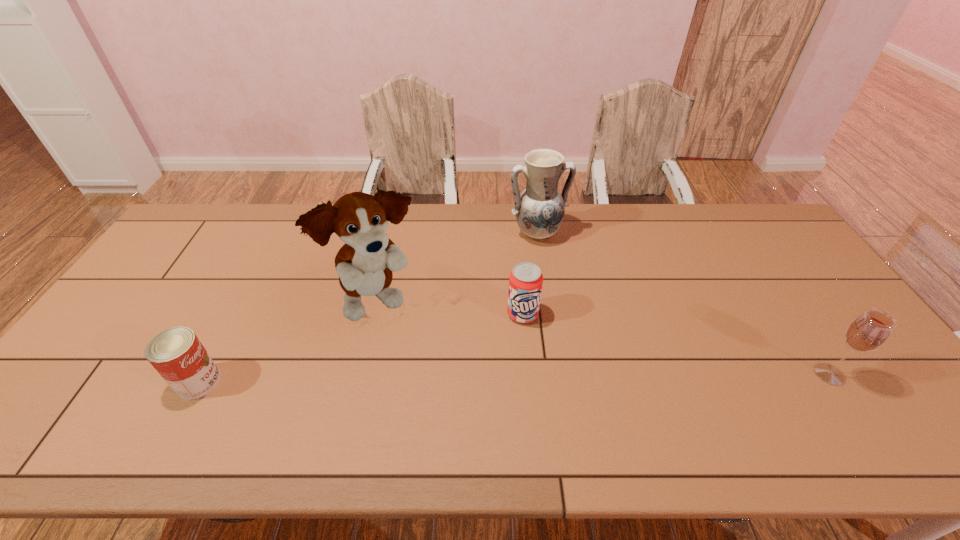
This screenshot has height=540, width=960. In order to click on vacant space on the desktop that is between the leftmost object and the rightmost object and is positioned on the surface of the soda can in this screenshot , I will do `click(525, 378)`.

Find the location of a particular element. free space on the desktop that is between the leftmost object and the wineglass and is positioned on either side of the farthest object is located at coordinates 598,377.

The height and width of the screenshot is (540, 960). What are the coordinates of `vacant spot on the desktop that is between the can and the rightmost object and is positioned on the face of the puppy` in the screenshot? It's located at (463, 379).